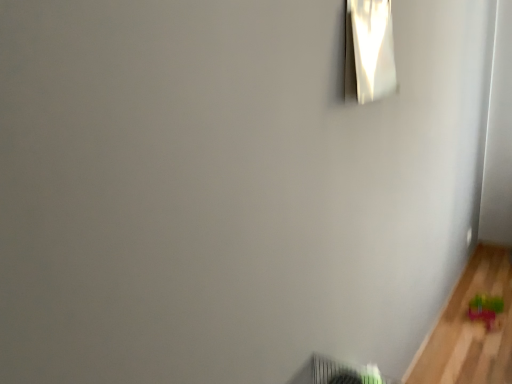
The width and height of the screenshot is (512, 384). What do you see at coordinates (369, 50) in the screenshot?
I see `white glossy lampshade at upper right` at bounding box center [369, 50].

Image resolution: width=512 pixels, height=384 pixels. I want to click on white glossy lampshade at upper right, so click(x=369, y=50).

Locate an element on the screen. The width and height of the screenshot is (512, 384). white glossy lampshade at upper right is located at coordinates (369, 50).